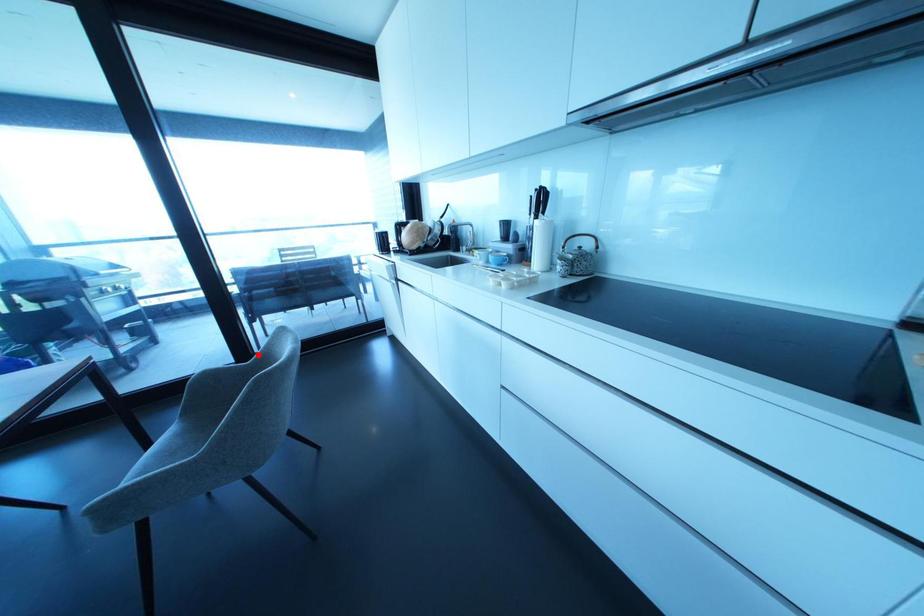
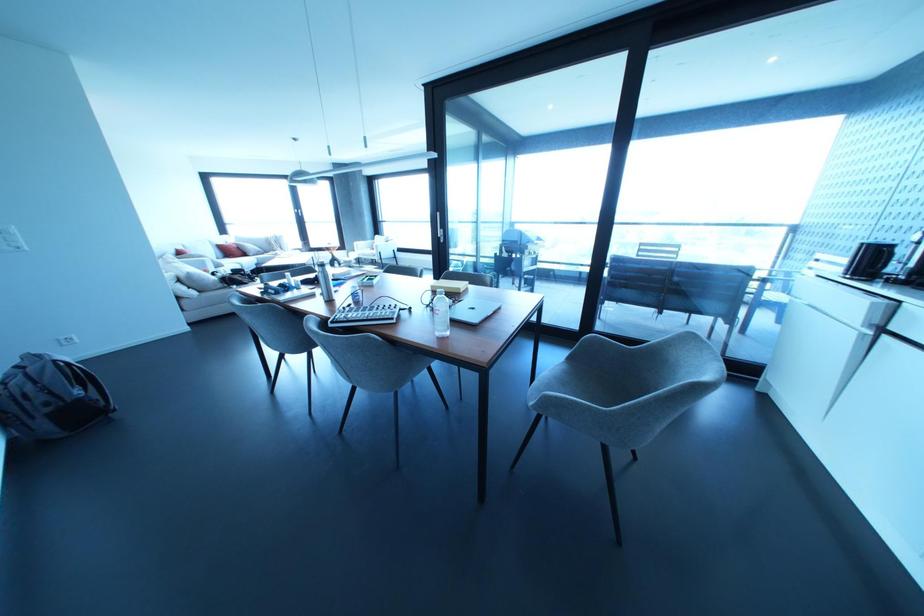
Question: I am providing you with two images of the same scene from different viewpoints. Given a red point in image1, look at the same physical point in image2. Is it:

Choices:
 (A) Closer to the viewpoint
 (B) Farther from the viewpoint

Answer: (A)